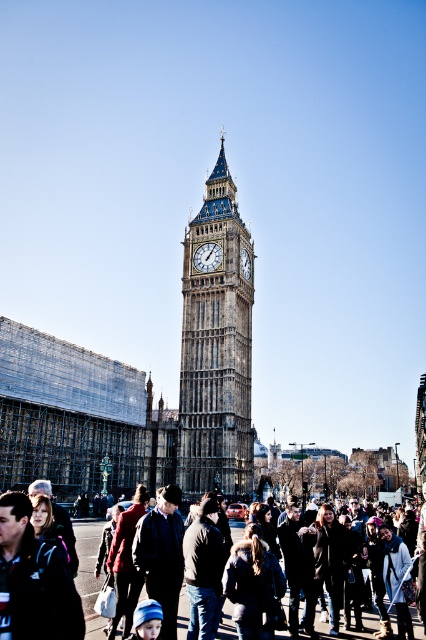
Question: Can you confirm if stone clock tower at center is positioned above dark brown leather jacket at lower center?

Choices:
 (A) no
 (B) yes

Answer: (B)

Question: Observing the image, what is the correct spatial positioning of dark brown leather jacket at lower center in reference to gold textured clock at center?

Choices:
 (A) left
 (B) right

Answer: (B)

Question: Which object appears closest to the camera in this image?

Choices:
 (A) dark brown leather jacket at lower center
 (B) stone clock tower at center
 (C) gold textured clock at center

Answer: (A)

Question: Does stone clock tower at center lie behind gold textured clock at center?

Choices:
 (A) yes
 (B) no

Answer: (B)

Question: Which point is closer to the camera?

Choices:
 (A) dark brown leather jacket at lower center
 (B) stone clock tower at center

Answer: (A)

Question: Which of the following is the closest to the observer?

Choices:
 (A) dark brown leather jacket at lower center
 (B) stone clock tower at center

Answer: (A)